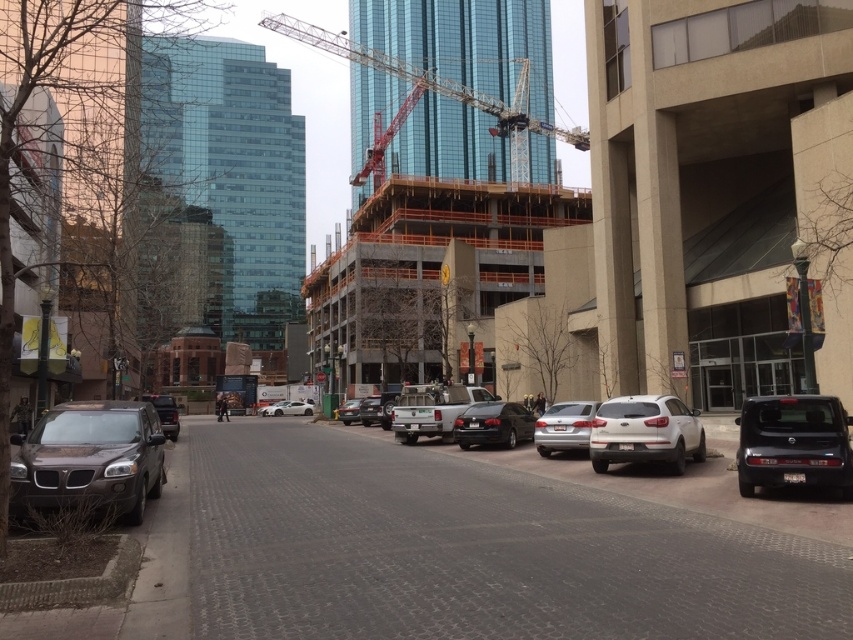
Which is more to the left, brown matte suv at lower left or shiny black sedan at center?

brown matte suv at lower left

Which is below, brown matte suv at lower left or shiny black sedan at center?

shiny black sedan at center is lower down.

You are a GUI agent. You are given a task and a screenshot of the screen. Output one action in this format:
    pyautogui.click(x=<x>, y=<y>)
    Task: Click on the brown matte suv at lower left
    Image resolution: width=853 pixels, height=640 pixels.
    Given the screenshot: What is the action you would take?
    pyautogui.click(x=90, y=458)

The image size is (853, 640). Find the location of `brown matte suv at lower left`. brown matte suv at lower left is located at coordinates (90, 458).

Who is shorter, white matte truck at center or matte black truck at center?

Standing shorter between the two is matte black truck at center.

In the scene shown: Can you confirm if white matte truck at center is thinner than matte black truck at center?

No.

Does point (474, 401) come behind point (357, 408)?

No, it is in front of (357, 408).

Find the location of a particular element. Image resolution: width=853 pixels, height=640 pixels. white matte truck at center is located at coordinates (431, 410).

In the scene shown: Which is above, black matte suv at lower right or white matte suv at center?

black matte suv at lower right is above.

Who is lower down, black matte suv at lower right or white matte suv at center?

white matte suv at center

The height and width of the screenshot is (640, 853). In order to click on black matte suv at lower right in this screenshot , I will do `click(793, 444)`.